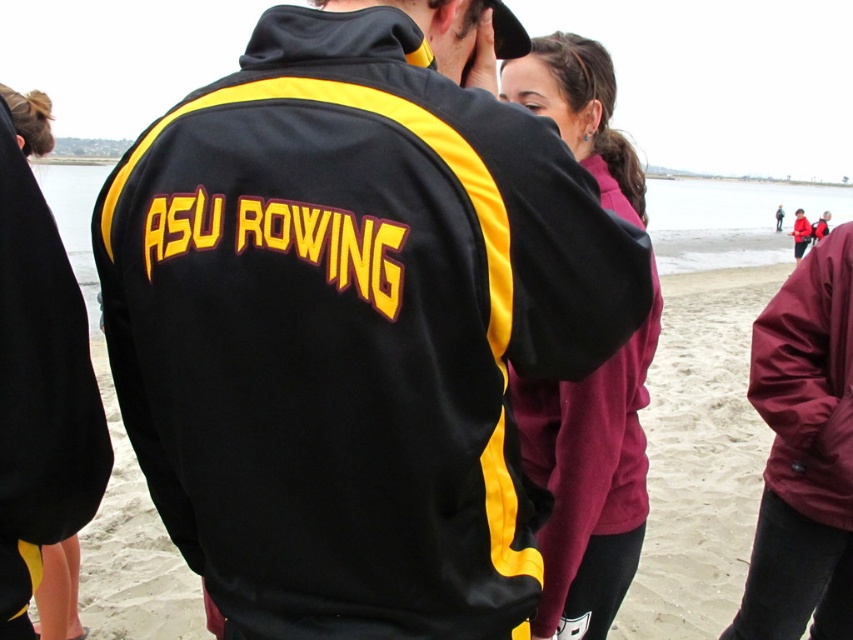
Question: Which object is positioned closest to the black/yellow track jacket at center?

Choices:
 (A) maroon fleece jacket at center
 (B) maroon fabric jacket at right
 (C) sandy beach at center

Answer: (A)

Question: Which point appears closest to the camera in this image?

Choices:
 (A) (415, 115)
 (B) (767, 355)
 (C) (566, 612)
 (D) (126, 586)

Answer: (A)

Question: Does black/yellow track jacket at center lie behind sandy beach at center?

Choices:
 (A) yes
 (B) no

Answer: (B)

Question: Which point is farther to the camera?

Choices:
 (A) maroon fleece jacket at center
 (B) maroon fabric jacket at right
 (C) sandy beach at center

Answer: (B)

Question: Is sandy beach at center in front of maroon fleece jacket at center?

Choices:
 (A) no
 (B) yes

Answer: (B)

Question: Can you confirm if maroon fleece jacket at center is positioned to the left of maroon fabric jacket at right?

Choices:
 (A) yes
 (B) no

Answer: (A)